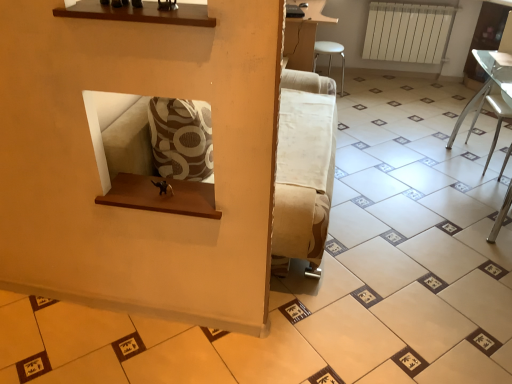
Question: From the image's perspective, relative to white plastic stool at upper right, which ranks as the 2th furniture in right-to-left order, is clear glass table at right, marked as the 2th furniture in a top-to-bottom arrangement, above or below?

Choices:
 (A) below
 (B) above

Answer: (A)

Question: Is point (497, 104) positioned closer to the camera than point (325, 41)?

Choices:
 (A) closer
 (B) farther

Answer: (A)

Question: Estimate the real-world distances between objects in this image. Which object is closer to the clear glass table at right, which is the 1th furniture in right-to-left order?

Choices:
 (A) white plastic stool at upper right, which appears as the 1th furniture when viewed from the left
 (B) white fabric armchair at lower right
 (C) white matte radiator at upper right

Answer: (B)

Question: Estimate the real-world distances between objects in this image. Which object is farther from the white fabric armchair at lower right?

Choices:
 (A) white plastic stool at upper right, which ranks as the 2th furniture in right-to-left order
 (B) white matte radiator at upper right
 (C) clear glass table at right, which appears as the 1th furniture when ordered from the bottom

Answer: (A)